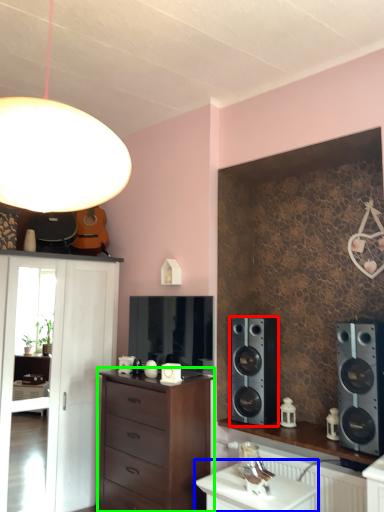
Question: Which is farther away from speaker (highlighted by a red box)? table (highlighted by a blue box) or chest of drawers (highlighted by a green box)?

Choices:
 (A) table
 (B) chest of drawers

Answer: (A)